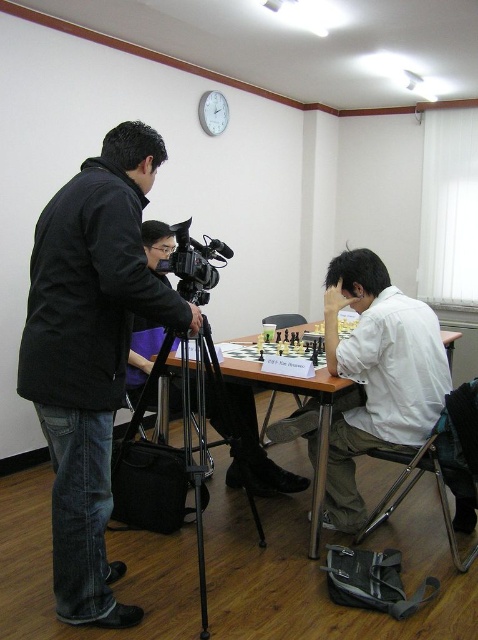
Question: Among these points, which one is farthest from the camera?

Choices:
 (A) (197, 250)
 (B) (428, 362)

Answer: (B)

Question: Does white matte shirt at center lie in front of black metal tripod at center?

Choices:
 (A) no
 (B) yes

Answer: (A)

Question: Does black matte jacket at left appear over black plastic video camera at center?

Choices:
 (A) yes
 (B) no

Answer: (B)

Question: Considering the real-world distances, which object is closest to the wooden at center?

Choices:
 (A) black plastic video camera at center
 (B) black matte jacket at left
 (C) black metal tripod at center

Answer: (C)

Question: Can you confirm if white matte shirt at center is positioned to the right of black metal tripod at center?

Choices:
 (A) yes
 (B) no

Answer: (A)

Question: Among these points, which one is nearest to the camera?

Choices:
 (A) (177, 268)
 (B) (456, 332)

Answer: (A)